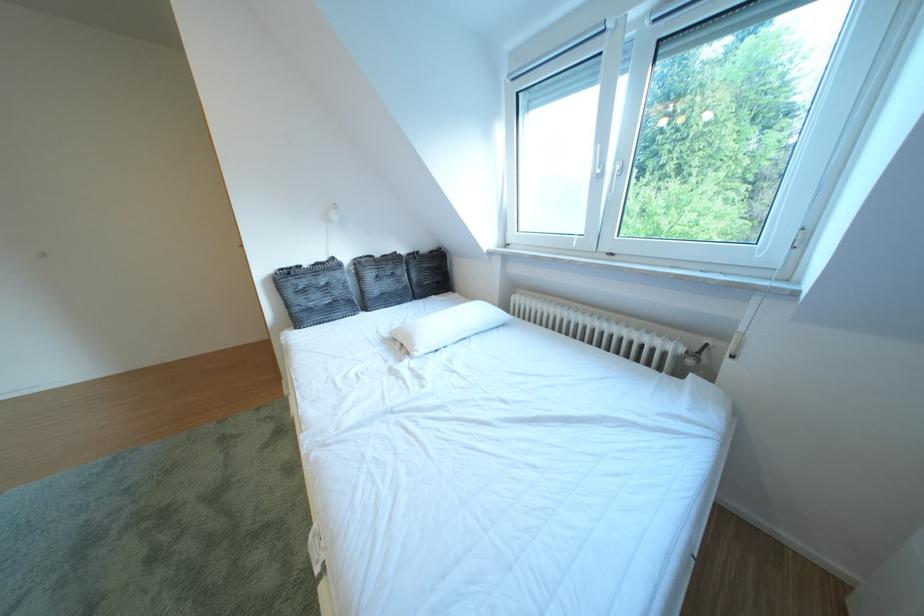
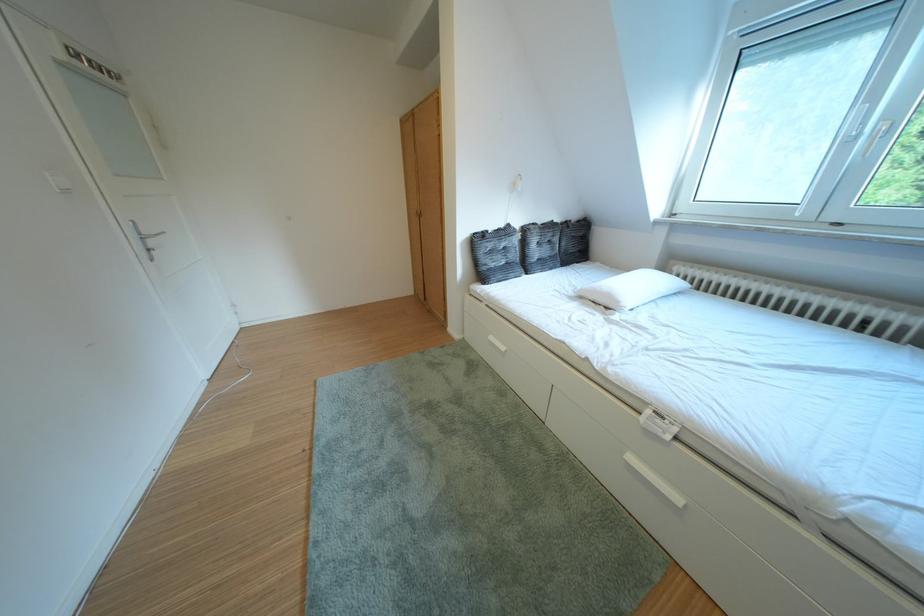
Question: The camera is either moving clockwise (left) or counter-clockwise (right) around the object. The first image is from the beginning of the video and the second image is from the end. Is the camera moving left or right when shooting the video?

Choices:
 (A) Left
 (B) Right

Answer: (B)